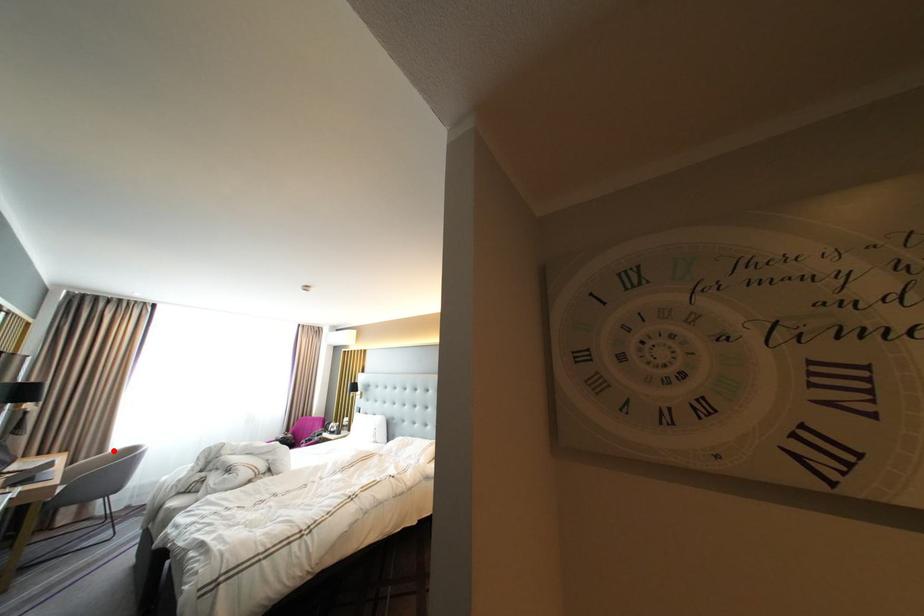
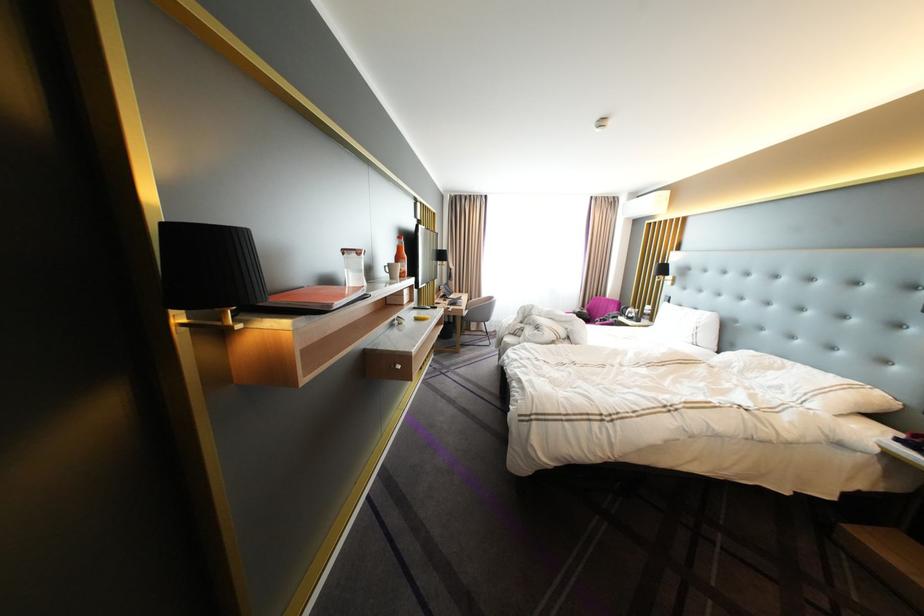
Locate, in the second image, the point that corresponds to the highlighted location in the first image.

(492, 296)